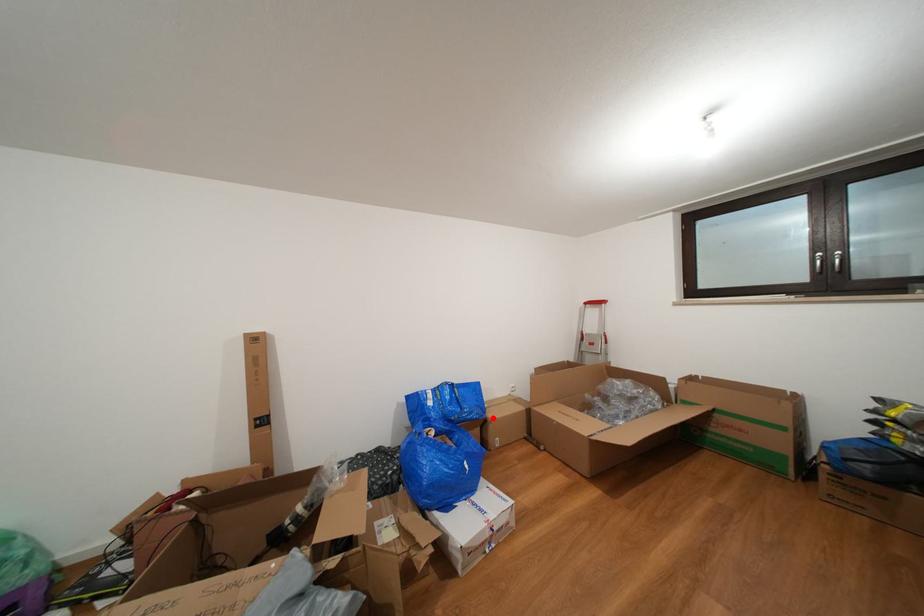
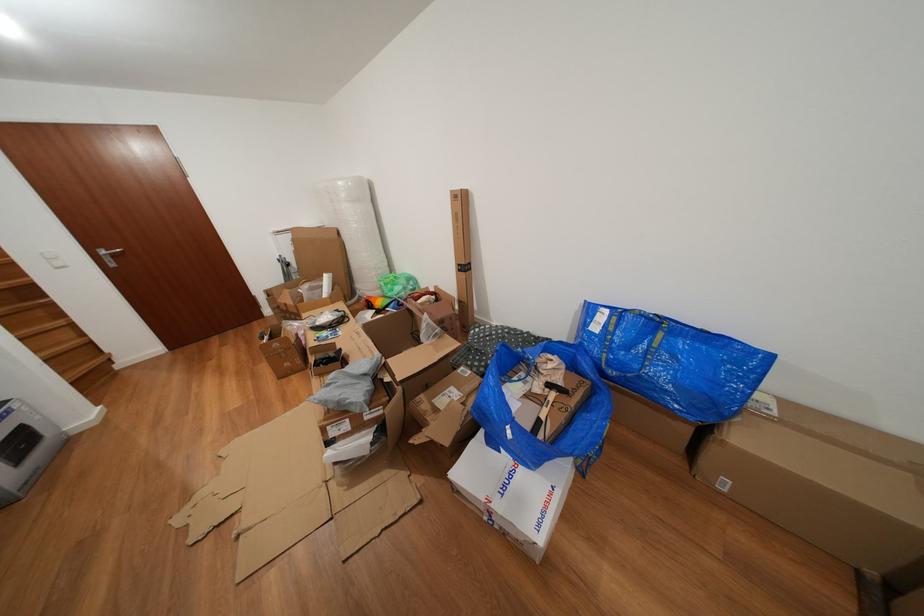
Locate, in the second image, the point that corresponds to the highlighted location in the first image.

(734, 424)